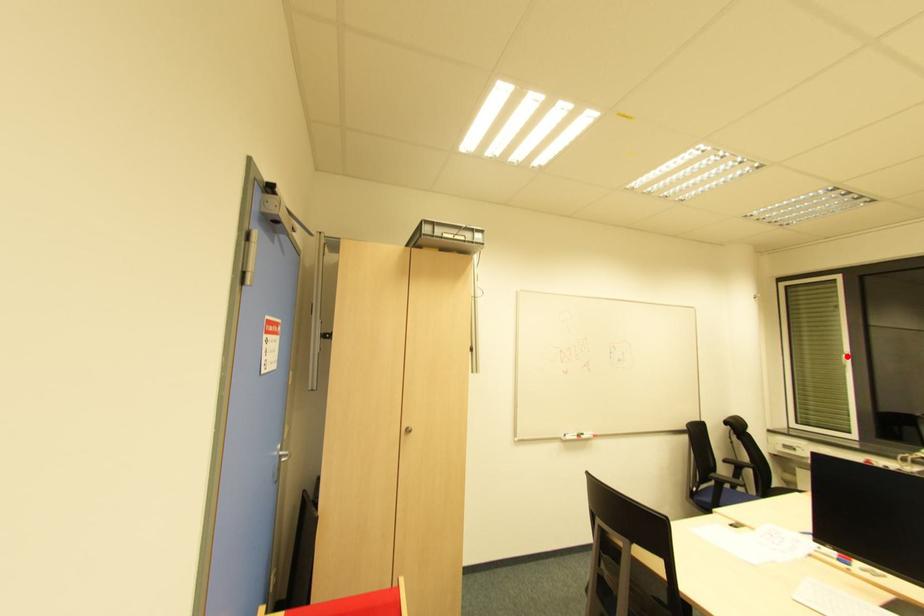
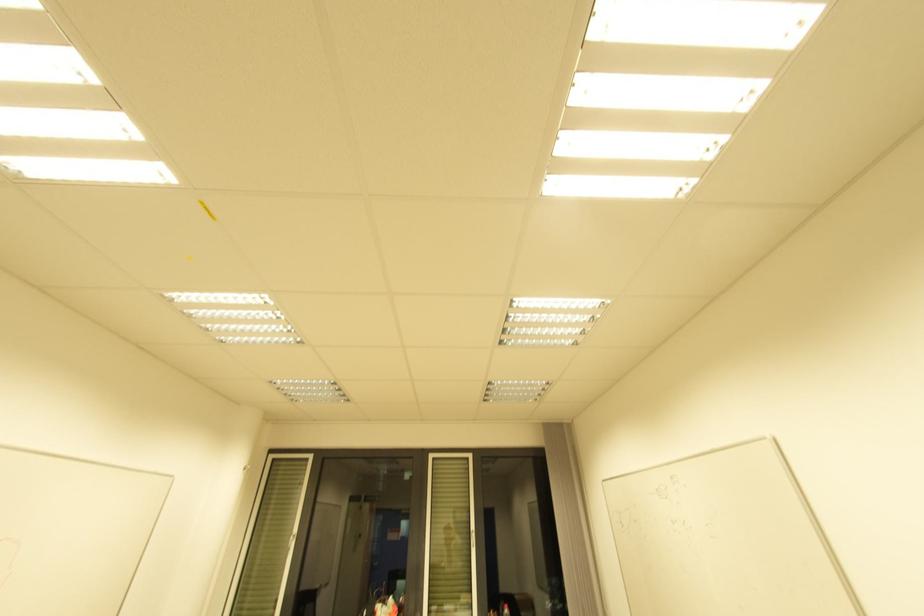
Where in the second image is the point corresponding to the highlighted location from the first image?

(294, 538)